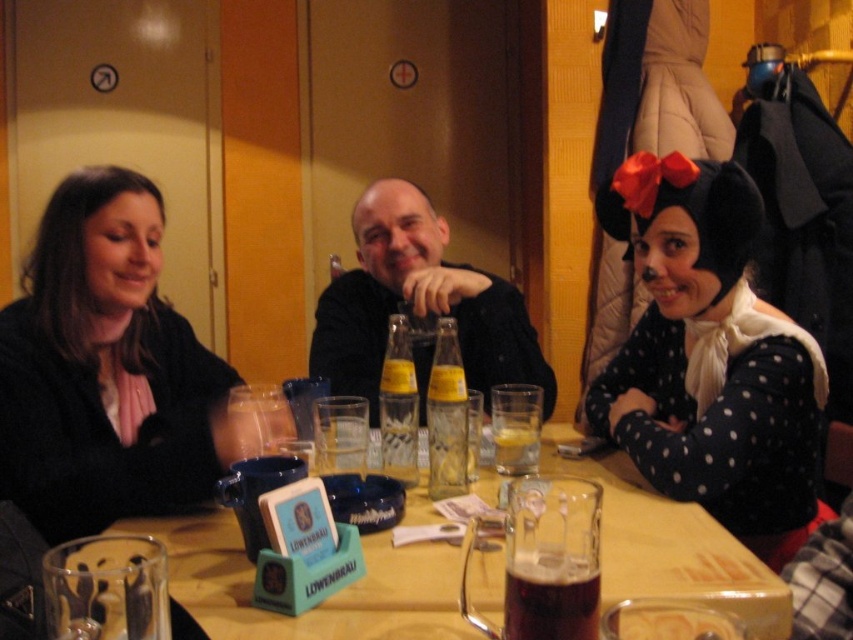
You are a photographer who needs to take a photo of the matte black sweater at left. The camera you have is 3.77 feet away from the sweater. Is the distance sufficient to capture the sweater in focus?

The matte black sweater at left and camera are 3.77 feet apart from each other. The distance is sufficient to capture the sweater in focus as most cameras can focus at that distance.

You are a photographer setting up a camera to take a group photo of the people at the table. The camera has a focus ring that can only focus on objects of a specific size. You need to ensure that both the black felt hat at upper right and the black matte shirt at center are in focus. Given that the focus ring can only accommodate one size setting, which object should you set the focus ring to to ensure both are in focus?

The black felt hat at upper right is bigger than the black matte shirt at center. To ensure both are in focus, set the focus ring to the size of the black felt hat at upper right since it is larger and will encompass the smaller black matte shirt at center within the focus range.

You are standing at the point marked as point (90, 312) and want to walk to the exit located at point (566, 624). Is there a clear path between these two points without any obstacles?

Yes, there is a clear path between point (90, 312) and point (566, 624) because the description states that point (90, 312) is behind point (566, 624), indicating they are aligned in a straight line with no obstructions between them.